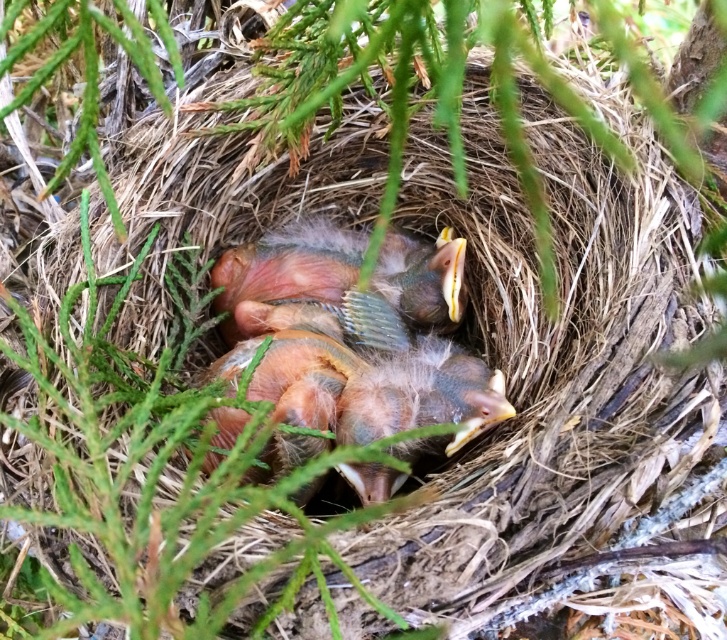
You are a wildlife photographer aiming to capture a close shot of the fluffy pinkish brown baby bird at center. You are currently positioned at point (289, 268). What direction should you move to get closer to the bird?

The fluffy pinkish brown baby bird at center is located at point (289, 268). Since you are already at that point, you are already at the location of the bird and cannot move closer without disturbing it.